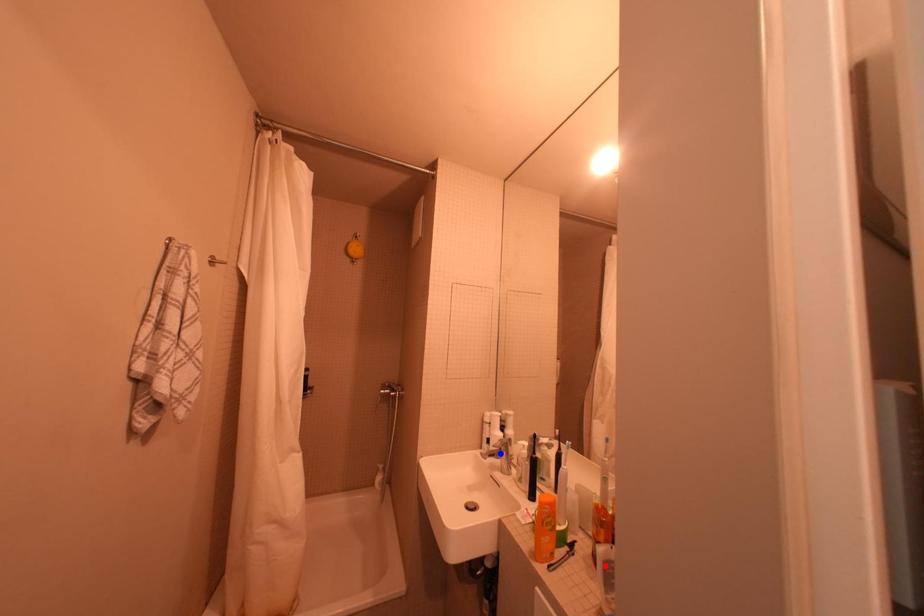
Question: Two points are marked on the image. Which point is closer to the camera?

Choices:
 (A) Blue point is closer.
 (B) Red point is closer.

Answer: (B)